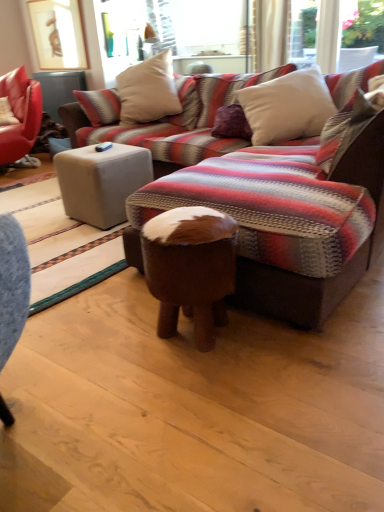
Question: Considering the positions of matte white ottoman at center, the first table positioned from the back, and white soft pillow at upper right, which is the 1th pillow in front-to-back order, in the image, is matte white ottoman at center, the first table positioned from the back, taller or shorter than white soft pillow at upper right, which is the 1th pillow in front-to-back order,?

Choices:
 (A) short
 (B) tall

Answer: (B)

Question: Considering the positions of point (61, 94) and point (349, 116), is point (61, 94) closer or farther from the camera than point (349, 116)?

Choices:
 (A) farther
 (B) closer

Answer: (A)

Question: Estimate the real-world distances between objects in this image. Which object is closer to the white soft pillow at upper right, the third pillow viewed from the back?

Choices:
 (A) white soft pillow at upper center, the second pillow from the front
 (B) brown leather stool at center
 (C) matte white ottoman at center, the second table from the bottom
 (D) beige fabric pillow at upper center, which is the 3th pillow in front-to-back order
 (E) beige fabric ottoman at center, the 1th table ordered from the bottom

Answer: (A)

Question: Which object is positioned farthest from the white soft pillow at upper right, which is the 1th pillow in front-to-back order?

Choices:
 (A) beige fabric ottoman at center, acting as the second table starting from the top
 (B) brown leather stool at center
 (C) beige fabric pillow at upper center, which is the first pillow in back-to-front order
 (D) matte white ottoman at center, the first table positioned from the back
 (E) white soft pillow at upper center, the second pillow from the front

Answer: (D)